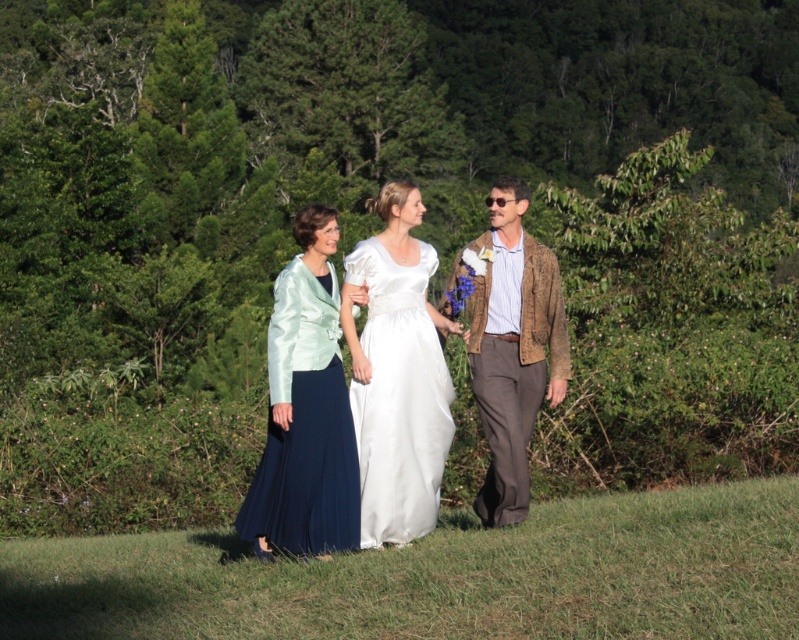
Question: Is satin blue dress at center to the right of satin white dress at center from the viewer's perspective?

Choices:
 (A) yes
 (B) no

Answer: (B)

Question: Is white satin dress at center wider than satin white dress at center?

Choices:
 (A) no
 (B) yes

Answer: (B)

Question: Does green grass at lower center appear over white satin dress at center?

Choices:
 (A) no
 (B) yes

Answer: (A)

Question: Among these objects, which one is nearest to the camera?

Choices:
 (A) satin white dress at center
 (B) satin blue dress at center
 (C) white satin dress at center

Answer: (B)

Question: Estimate the real-world distances between objects in this image. Which object is closer to the white satin dress at center?

Choices:
 (A) green grass at lower center
 (B) satin white dress at center
 (C) brown textured jacket at right

Answer: (B)

Question: Estimate the real-world distances between objects in this image. Which object is farther from the brown textured jacket at right?

Choices:
 (A) white satin dress at center
 (B) satin blue dress at center
 (C) satin white dress at center
 (D) green grass at lower center

Answer: (D)